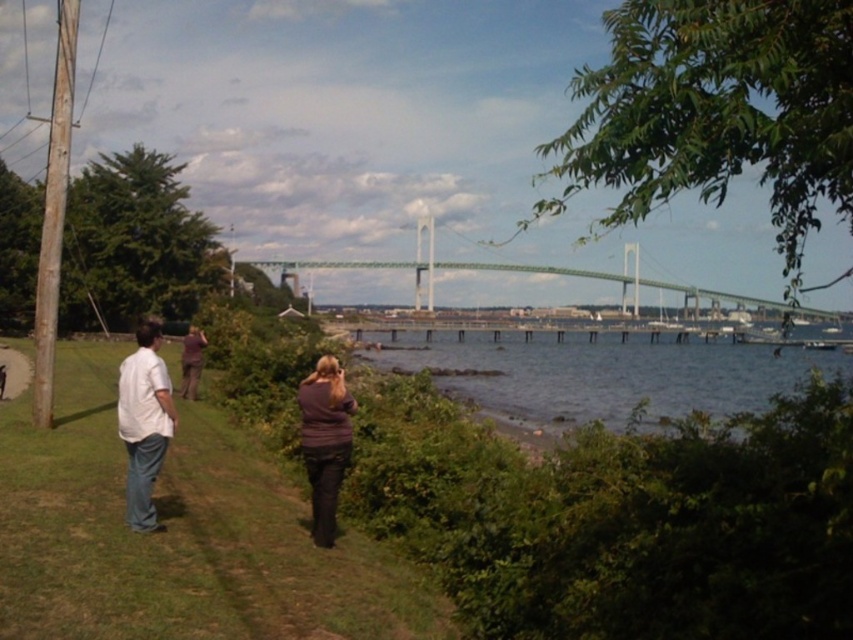
You are a photographer planning to take a photo of the green water at lower center and the green metallic bridge at center. Which object will appear narrower in the photo?

The green water at lower center will appear narrower in the photo because it is thinner than the green metallic bridge at center.

You are standing at the riverside and see the white cotton shirt at lower left and the green metallic bridge at center. Which object is positioned more to the left side of the scene?

The white cotton shirt at lower left is positioned to the left of the green metallic bridge at center, so it is more to the left side of the scene.